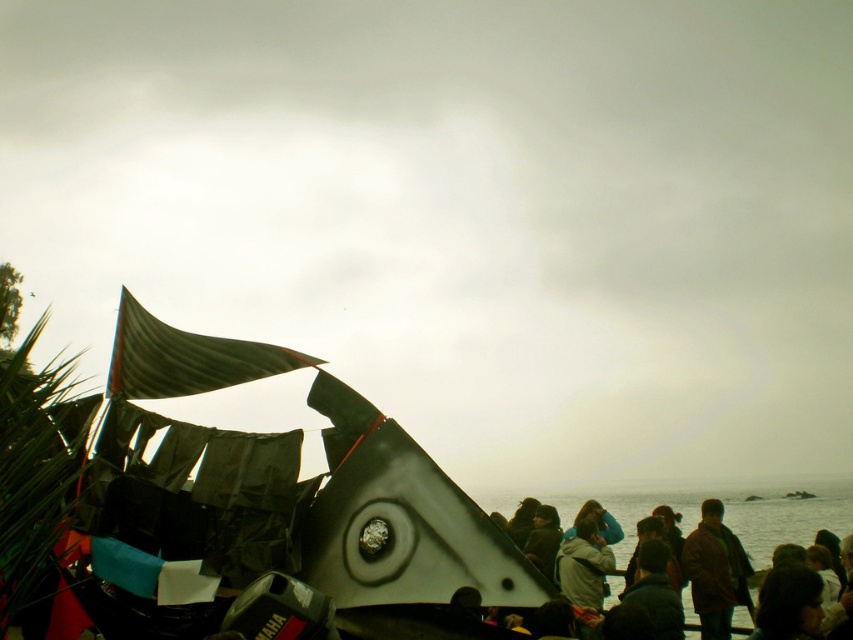
What do you see at coordinates (288, 496) in the screenshot? I see `shiny metallic boat at left` at bounding box center [288, 496].

Who is more distant from viewer, (222, 356) or (627, 550)?

The point (627, 550) is behind.

Locate an element on the screen. shiny metallic boat at left is located at coordinates (288, 496).

Is dark gray jacket at lower right closer to camera compared to brown woolen coat at lower right?

No, it is behind brown woolen coat at lower right.

Which is in front, point (683, 604) or point (692, 540)?

Point (683, 604) is more forward.

The height and width of the screenshot is (640, 853). In order to click on dark gray jacket at lower right in this screenshot , I will do `click(784, 524)`.

The image size is (853, 640). I want to click on dark gray jacket at lower right, so click(784, 524).

Does shiny metallic boat at left have a smaller size compared to brown woolen coat at lower right?

Actually, shiny metallic boat at left might be larger than brown woolen coat at lower right.

Which is more to the left, shiny metallic boat at left or brown woolen coat at lower right?

shiny metallic boat at left is more to the left.

Which is behind, point (109, 598) or point (711, 556)?

The point (711, 556) is behind.

You are a GUI agent. You are given a task and a screenshot of the screen. Output one action in this format:
    pyautogui.click(x=<x>, y=<y>)
    Task: Click on the shiny metallic boat at left
    The width and height of the screenshot is (853, 640).
    Given the screenshot: What is the action you would take?
    pyautogui.click(x=288, y=496)